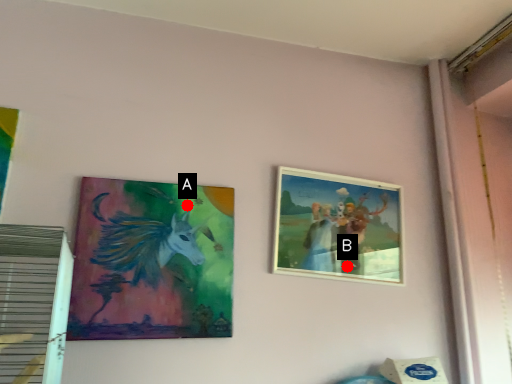
Question: Two points are circled on the image, labeled by A and B beside each circle. Which point appears farthest from the camera in this image?

Choices:
 (A) A is further
 (B) B is further

Answer: (B)